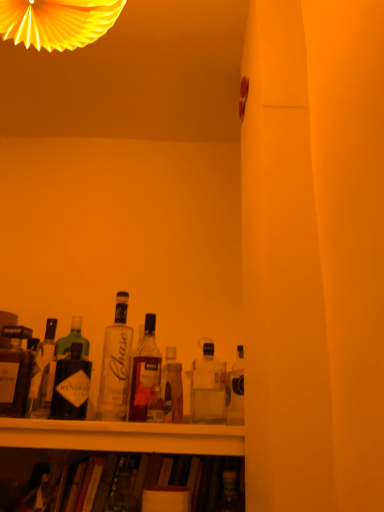
The image size is (384, 512). Find the location of `vacant space that is to the left of translucent glass bottle at center, arranged as the 2th bottle when viewed from the right`. vacant space that is to the left of translucent glass bottle at center, arranged as the 2th bottle when viewed from the right is located at coordinates (124, 418).